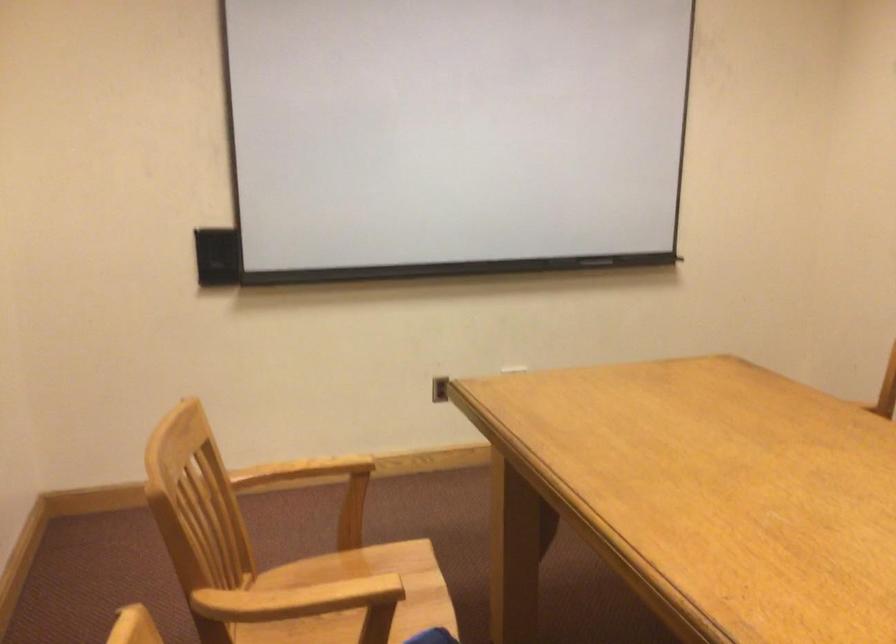
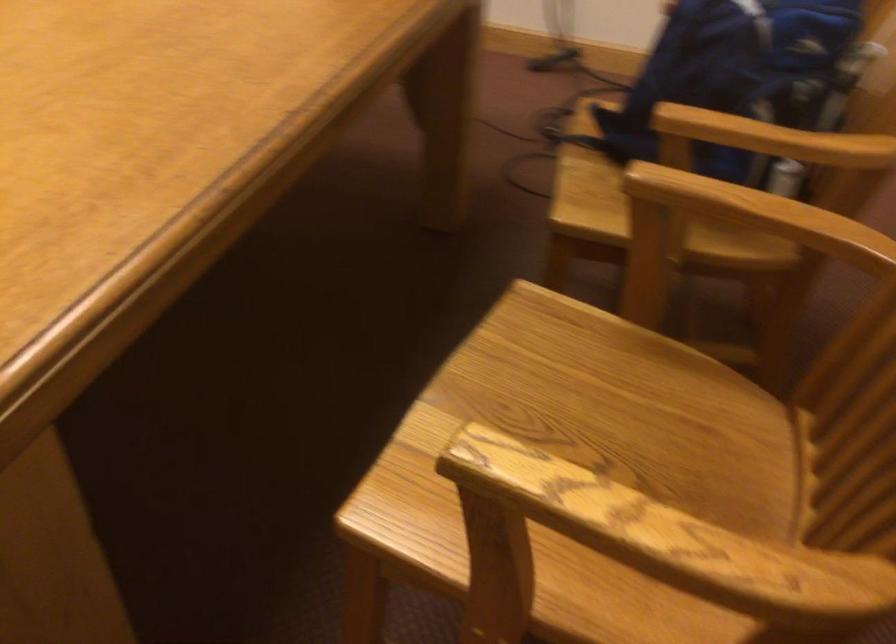
Find the pixel in the second image that matches (296,467) in the first image.

(658, 542)